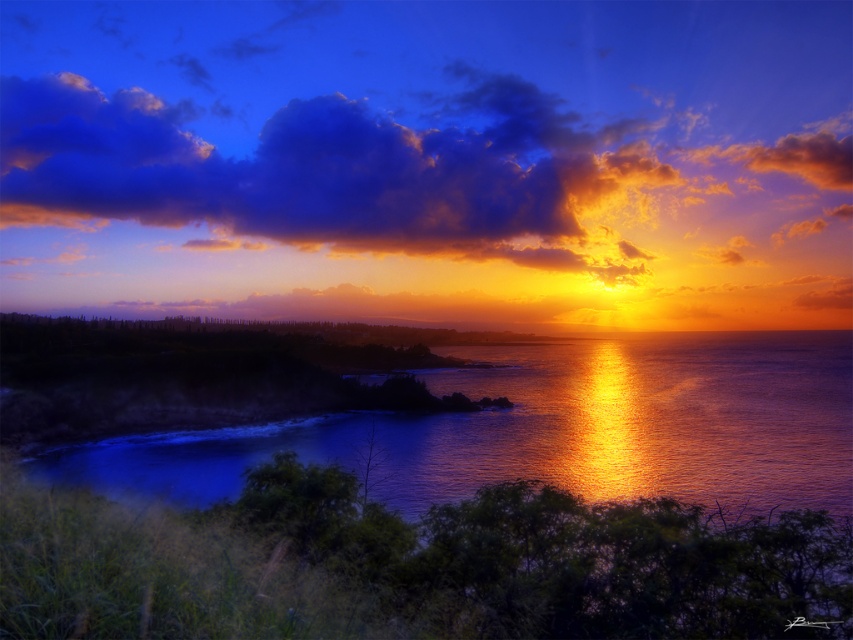
Is point (0, 109) more distant than point (659, 493)?

Yes, it is behind point (659, 493).

In order to click on cloudy sky at upper center in this screenshot , I will do `click(370, 173)`.

Locate an element on the screen. cloudy sky at upper center is located at coordinates (370, 173).